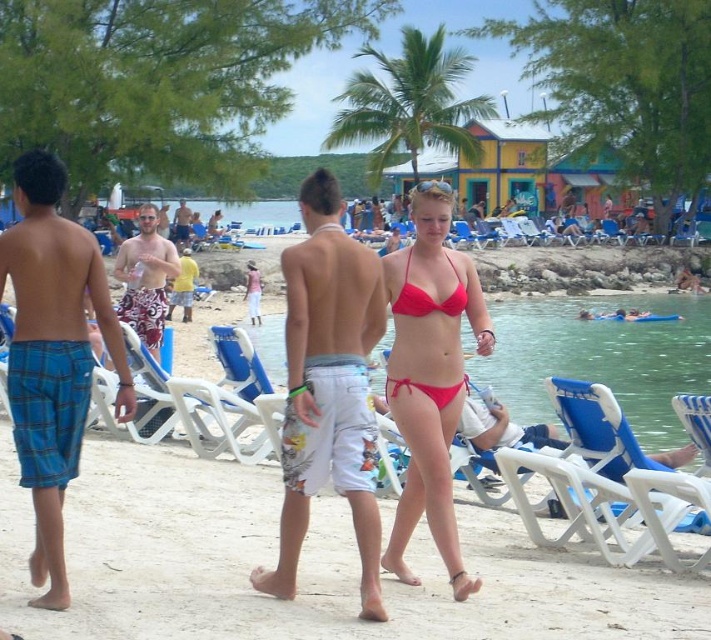
You are standing on the beach and want to take a photo of the green leafy palm tree at center. If your camera has a maximum focus range of 70 meters, will it be able to capture the tree clearly?

The green leafy palm tree at center and viewer are 70.12 meters apart from each other. Since the distance is slightly over 70 meters, the camera might not focus properly, resulting in a blurry image.

You are standing at point (410, 104) on the beach. What object is located exactly at this coordinate?

The green leafy palm tree at center is located exactly at point (410, 104).

From the picture: You are a photographer standing at the green leafy palm tree at center and want to take a photo of the matte white surfboard at center. If your camera has a maximum focus range of 15 meters, will you be able to capture the surfboard clearly?

The distance between the green leafy palm tree at center and the matte white surfboard at center is 15.77 meters, which exceeds the camera maximum focus range of 15 meters. Therefore, you won not be able to capture the surfboard clearly.